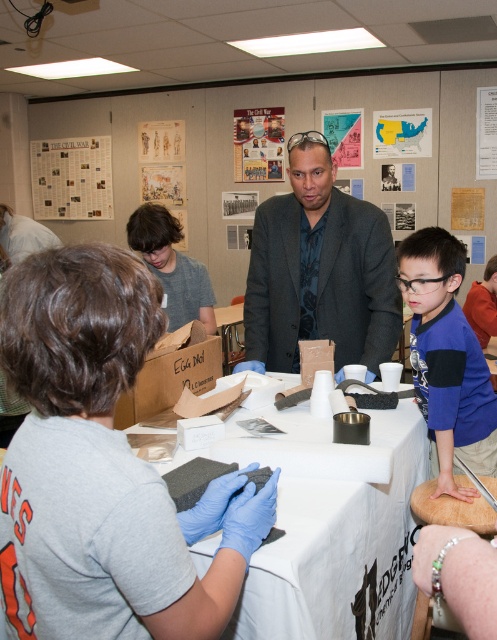
You are a student standing in front of the table and looking at the matte paper bulletin board at upper left and the gray cotton shirt at center. Which object is located to the left of the other?

The matte paper bulletin board at upper left is positioned on the left side of gray cotton shirt at center.

You are a participant in the activity and need to reach the gray fabric at center to complete a task. Considering your arm length is 25 inches, can you comfortably reach it without moving your position?

The gray fabric at center is 24.95 inches away from the viewer. Since your arm length is 25 inches, you can comfortably reach it without moving your position.

You are standing in front of the table in the classroom. You need to place a small object on the table. If you place it closer to you, which coordinate point should you choose between point (74,193) and point (189,294)?

You should choose point (74,193) because it is closer to you than point (189,294).